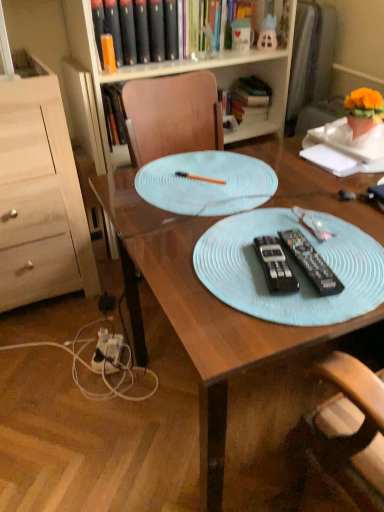
Find the location of a particular element. This screenshot has width=384, height=512. vacant space to the right of black plastic remote control at center, which appears as the 1th remote control when viewed from the left is located at coordinates (350, 256).